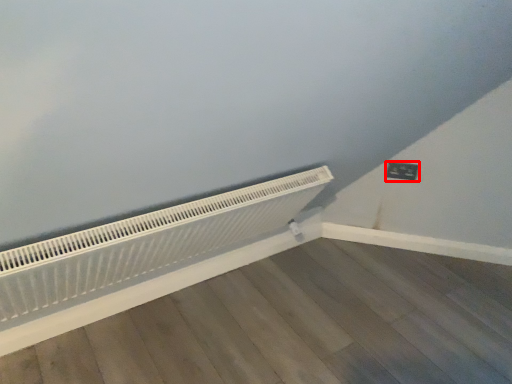
Question: From the image's perspective, considering the relative positions of electric outlet (annotated by the red box) and heater in the image provided, where is electric outlet (annotated by the red box) located with respect to the staircase?

Choices:
 (A) above
 (B) below

Answer: (A)